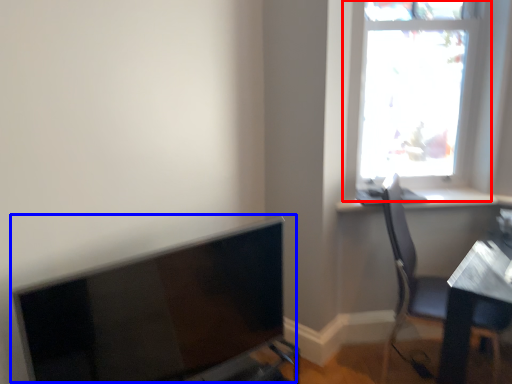
Question: Which object is closer to the camera taking this photo, window (highlighted by a red box) or computer monitor (highlighted by a blue box)?

Choices:
 (A) window
 (B) computer monitor

Answer: (B)